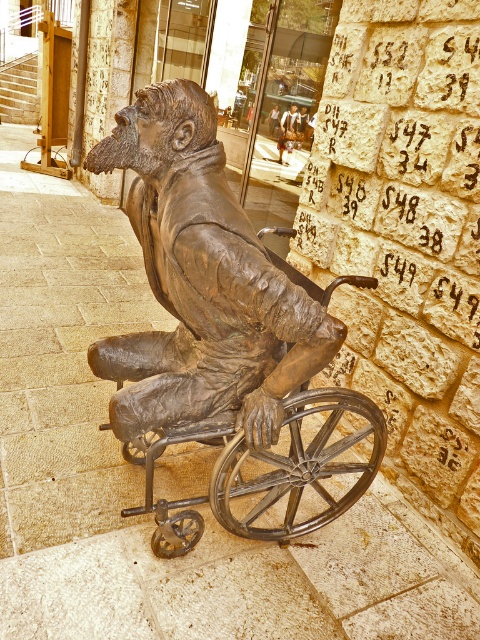
Is bronze statue at center shorter than bronze statue of man at center?

In fact, bronze statue at center may be taller than bronze statue of man at center.

Measure the distance from bronze statue at center to bronze statue of man at center.

The distance of bronze statue at center from bronze statue of man at center is 8.87 feet.

Image resolution: width=480 pixels, height=640 pixels. What do you see at coordinates (202, 282) in the screenshot? I see `bronze statue at center` at bounding box center [202, 282].

You are a GUI agent. You are given a task and a screenshot of the screen. Output one action in this format:
    pyautogui.click(x=<x>, y=<y>)
    Task: Click on the bronze statue at center
    The width and height of the screenshot is (480, 640).
    Given the screenshot: What is the action you would take?
    pyautogui.click(x=202, y=282)

Is bronze metal wheelchair at center to the right of bronze statue of man at center from the viewer's perspective?

Incorrect, bronze metal wheelchair at center is not on the right side of bronze statue of man at center.

Which is in front, point (348, 410) or point (287, 140)?

Point (348, 410) is in front.

Does point (348, 465) come closer to viewer compared to point (287, 156)?

Yes.

Image resolution: width=480 pixels, height=640 pixels. Identify the location of bronze metal wheelchair at center. (269, 468).

Does bronze statue at center lie behind bronze metal wheelchair at center?

That is False.

Which is more to the left, bronze statue at center or bronze metal wheelchair at center?

From the viewer's perspective, bronze statue at center appears more on the left side.

Is point (212, 188) positioned in front of point (183, 440)?

That is True.

You are a GUI agent. You are given a task and a screenshot of the screen. Output one action in this format:
    pyautogui.click(x=<x>, y=<y>)
    Task: Click on the bronze statue at center
    
    Given the screenshot: What is the action you would take?
    pyautogui.click(x=202, y=282)